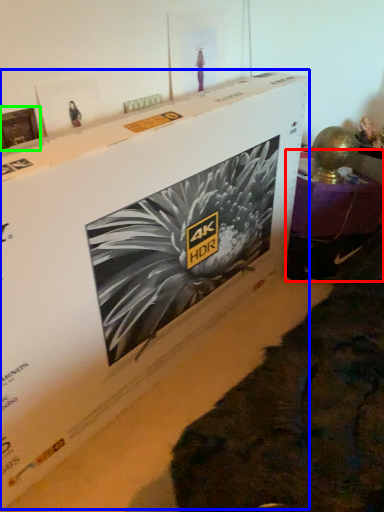
Question: Which object is positioned closest to furniture (highlighted by a red box)? Select from cardboard box (highlighted by a blue box) and picture frame (highlighted by a green box).

Choices:
 (A) cardboard box
 (B) picture frame

Answer: (A)